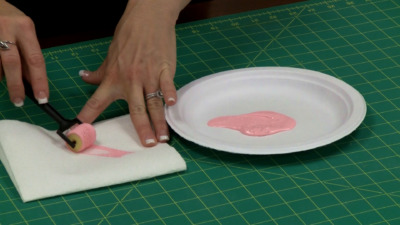
Find the location of `sponge`. sponge is located at coordinates (78, 137).